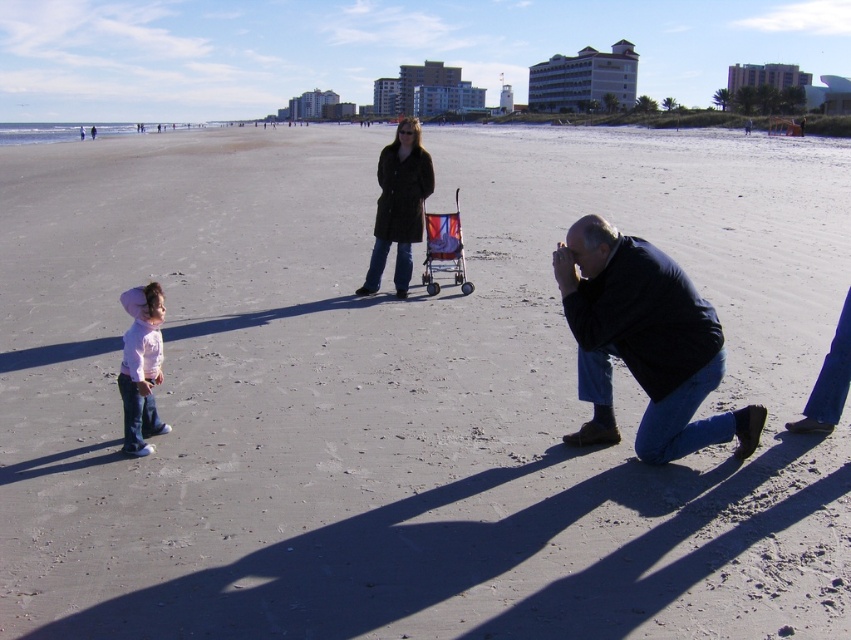
Question: Is dark blue jacket at lower right thinner than pink matte shirt at lower left?

Choices:
 (A) no
 (B) yes

Answer: (A)

Question: Can you confirm if dark blue jacket at lower right is wider than pink matte shirt at lower left?

Choices:
 (A) no
 (B) yes

Answer: (B)

Question: Which point is farther from the camera taking this photo?

Choices:
 (A) (153, 292)
 (B) (403, 285)

Answer: (B)

Question: Where is dark blue jacket at lower right located in relation to pink matte shirt at lower left in the image?

Choices:
 (A) right
 (B) left

Answer: (A)

Question: Which of the following is the closest to the observer?

Choices:
 (A) dark brown coat at center
 (B) dark blue jacket at lower right

Answer: (B)

Question: Which object appears closest to the camera in this image?

Choices:
 (A) pink matte shirt at lower left
 (B) dark blue jacket at lower right

Answer: (B)